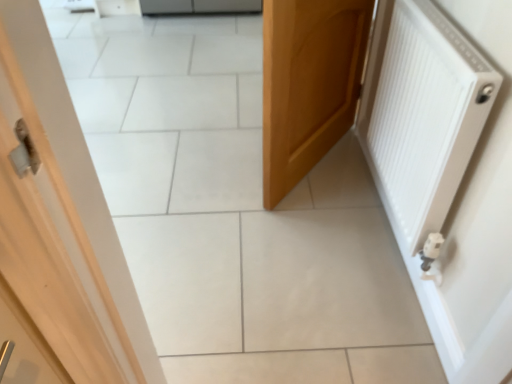
The height and width of the screenshot is (384, 512). Identify the location of vacant area situated below white matte radiator at right (from a real-world perspective). (384, 226).